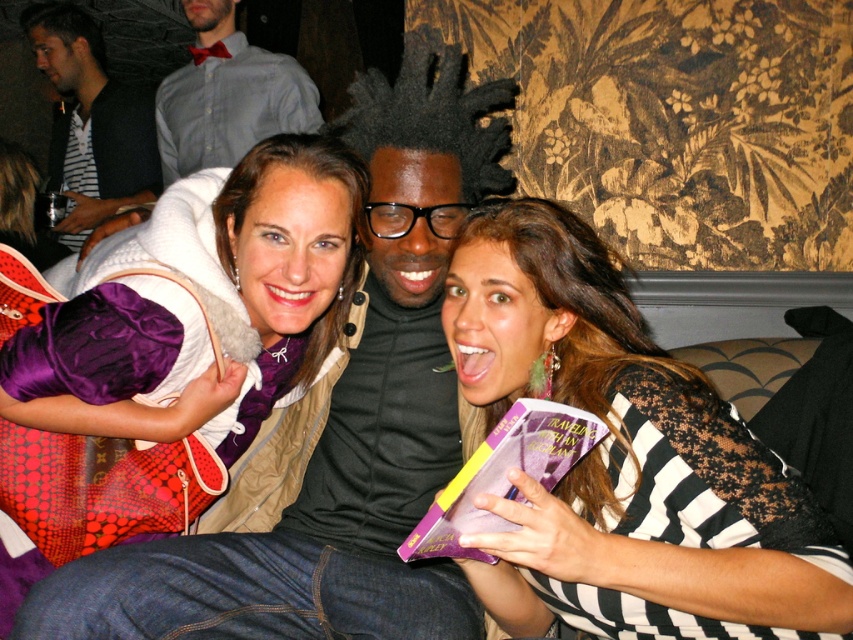
Question: Which of the following is the farthest from the observer?

Choices:
 (A) purple matte book at center
 (B) matte gray shirt at upper left
 (C) striped shirt at upper left

Answer: (C)

Question: Does striped lace dress at center appear on the left side of matte purple scarf at center?

Choices:
 (A) no
 (B) yes

Answer: (A)

Question: Among these objects, which one is nearest to the camera?

Choices:
 (A) purple matte book at center
 (B) matte gray shirt at upper left
 (C) matte purple scarf at center
 (D) striped shirt at upper left

Answer: (A)

Question: Which object is positioned farthest from the purple matte book at center?

Choices:
 (A) matte gray shirt at upper left
 (B) matte purple scarf at center

Answer: (A)

Question: Observing the image, what is the correct spatial positioning of striped lace dress at center in reference to matte gray shirt at upper left?

Choices:
 (A) above
 (B) below

Answer: (B)

Question: Can you confirm if striped lace dress at center is positioned above purple matte book at center?

Choices:
 (A) yes
 (B) no

Answer: (A)